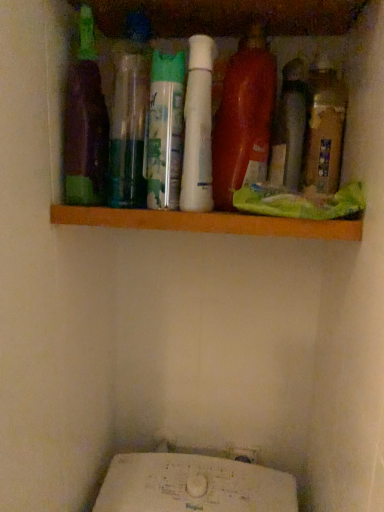
Question: Which direction should I rotate to look at green matte spray can at center, the fifth bottle in the right-to-left sequence?

Choices:
 (A) right
 (B) left

Answer: (B)

Question: Considering the relative sizes of wooden shelf at upper center and shiny orange bottle at center, the 3th bottle viewed from the right, in the image provided, is wooden shelf at upper center shorter than shiny orange bottle at center, the 3th bottle viewed from the right,?

Choices:
 (A) no
 (B) yes

Answer: (B)

Question: Is wooden shelf at upper center in front of shiny orange bottle at center, the 3th bottle viewed from the right?

Choices:
 (A) yes
 (B) no

Answer: (A)

Question: Is wooden shelf at upper center far from shiny orange bottle at center, the 3th bottle viewed from the right?

Choices:
 (A) yes
 (B) no

Answer: (B)

Question: Would you say wooden shelf at upper center is outside shiny orange bottle at center, the 3th bottle viewed from the right?

Choices:
 (A) yes
 (B) no

Answer: (A)

Question: From a real-world perspective, is wooden shelf at upper center below shiny orange bottle at center, the 3th bottle viewed from the right?

Choices:
 (A) yes
 (B) no

Answer: (A)

Question: From the image's perspective, does wooden shelf at upper center appear lower than shiny orange bottle at center, which is the fifth bottle from left to right?

Choices:
 (A) no
 (B) yes

Answer: (B)

Question: Is wooden shelf at upper center next to green matte spray can at center, the sixth bottle in the right-to-left sequence?

Choices:
 (A) yes
 (B) no

Answer: (B)

Question: Would you consider wooden shelf at upper center to be distant from green matte spray can at center, the sixth bottle in the right-to-left sequence?

Choices:
 (A) yes
 (B) no

Answer: (B)

Question: Is wooden shelf at upper center completely or partially outside of green matte spray can at center, positioned as the 2th bottle in left-to-right order?

Choices:
 (A) yes
 (B) no

Answer: (A)

Question: Is wooden shelf at upper center to the right of green matte spray can at center, positioned as the 2th bottle in left-to-right order, from the viewer's perspective?

Choices:
 (A) yes
 (B) no

Answer: (A)

Question: From a real-world perspective, is wooden shelf at upper center positioned over green matte spray can at center, the sixth bottle in the right-to-left sequence, based on gravity?

Choices:
 (A) yes
 (B) no

Answer: (B)

Question: Can you confirm if wooden shelf at upper center is positioned to the left of green matte spray can at center, the sixth bottle in the right-to-left sequence?

Choices:
 (A) no
 (B) yes

Answer: (A)

Question: Can you confirm if brown matte bottle at right, which is counted as the 1th bottle, starting from the right, is positioned to the right of green matte spray can at center, which ranks as the third bottle in left-to-right order?

Choices:
 (A) no
 (B) yes

Answer: (B)